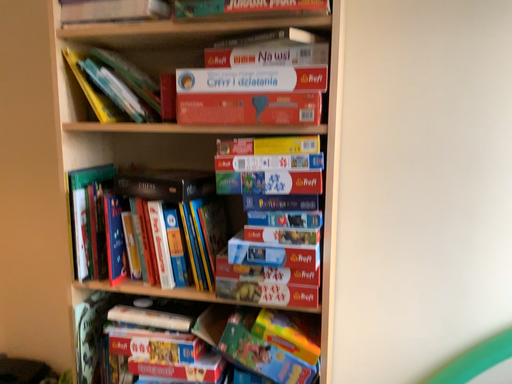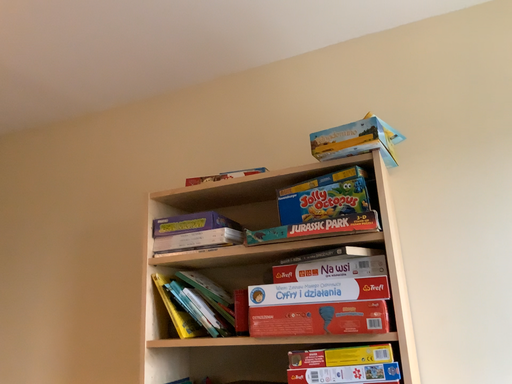
Question: How did the camera likely rotate when shooting the video?

Choices:
 (A) rotated right
 (B) rotated left

Answer: (B)